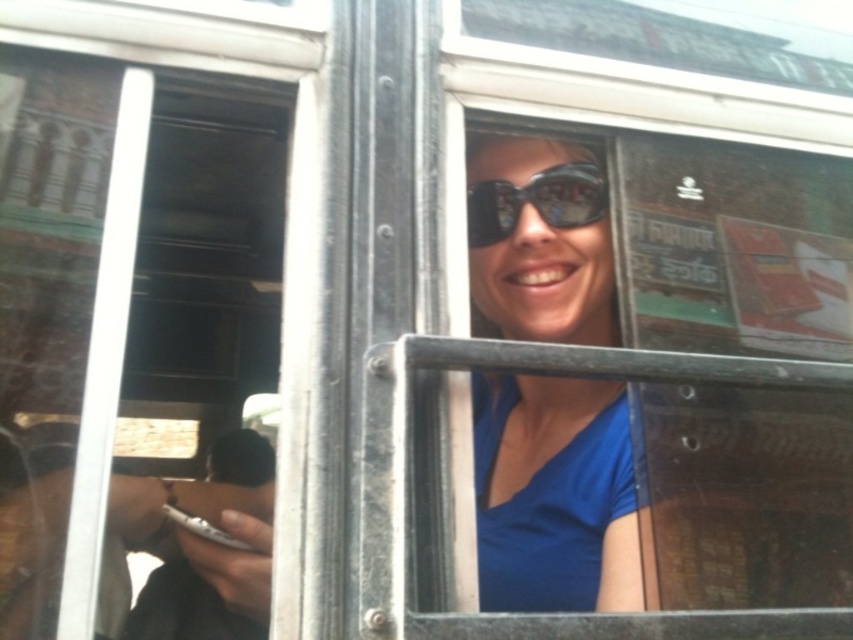
You are a fashion designer observing a person wearing a blue matte shirt at center and black matte goggles at center. Which item of clothing or accessory takes up more visual space in the image?

The blue matte shirt at center is larger in size than the black matte goggles at center, so the blue matte shirt at center takes up more visual space in the image.

Consider the image. You are a photographer trying to capture the person in the image. Since the blue matte shirt at center and black matte goggles at center are both at the center, which one should you focus on to ensure the subject is clearly visible?

The blue matte shirt at center is taller than the black matte goggles at center, so focusing on the blue matte shirt at center would ensure the subject is clearly visible as it occupies more vertical space in the frame.

You are a passenger on a public transport vehicle and want to adjust your accessories. You have a blue matte shirt at center and black matte goggles at center. Which accessory is currently covering more of your face?

The black matte goggles at center are positioned above the blue matte shirt at center, so they are covering more of your face.